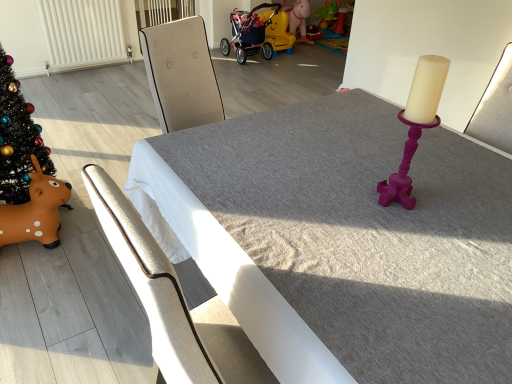
Question: Is the position of smooth gray table at center less distant than that of shiny black christmas tree at left?

Choices:
 (A) no
 (B) yes

Answer: (B)

Question: Does smooth gray table at center have a greater height compared to shiny black christmas tree at left?

Choices:
 (A) yes
 (B) no

Answer: (B)

Question: Does smooth gray table at center have a lesser height compared to shiny black christmas tree at left?

Choices:
 (A) no
 (B) yes

Answer: (B)

Question: Is smooth gray table at center thinner than shiny black christmas tree at left?

Choices:
 (A) no
 (B) yes

Answer: (A)

Question: Considering the relative positions of smooth gray table at center and shiny black christmas tree at left in the image provided, is smooth gray table at center to the right of shiny black christmas tree at left from the viewer's perspective?

Choices:
 (A) yes
 (B) no

Answer: (A)

Question: Considering the positions of smooth gray table at center and white textured radiator at upper left in the image, is smooth gray table at center taller or shorter than white textured radiator at upper left?

Choices:
 (A) short
 (B) tall

Answer: (B)

Question: Relative to white textured radiator at upper left, is smooth gray table at center in front or behind?

Choices:
 (A) behind
 (B) front

Answer: (B)

Question: From a real-world perspective, is smooth gray table at center physically located above or below white textured radiator at upper left?

Choices:
 (A) above
 (B) below

Answer: (A)

Question: Based on their sizes in the image, would you say smooth gray table at center is bigger or smaller than white textured radiator at upper left?

Choices:
 (A) big
 (B) small

Answer: (A)

Question: Considering the positions of rubber yellow horse at center, the 2th toy when ordered from bottom to top, and shiny black christmas tree at left in the image, is rubber yellow horse at center, the 2th toy when ordered from bottom to top, taller or shorter than shiny black christmas tree at left?

Choices:
 (A) tall
 (B) short

Answer: (B)

Question: Considering the positions of rubber yellow horse at center, which ranks as the 1th toy in top-to-bottom order, and shiny black christmas tree at left in the image, is rubber yellow horse at center, which ranks as the 1th toy in top-to-bottom order, wider or thinner than shiny black christmas tree at left?

Choices:
 (A) thin
 (B) wide

Answer: (B)

Question: From a real-world perspective, is rubber yellow horse at center, marked as the 1th toy in a right-to-left arrangement, above or below shiny black christmas tree at left?

Choices:
 (A) below
 (B) above

Answer: (A)

Question: Is rubber yellow horse at center, the 2th toy when ordered from bottom to top, inside the boundaries of shiny black christmas tree at left, or outside?

Choices:
 (A) outside
 (B) inside

Answer: (A)

Question: From the image's perspective, is pink fabric baby carriage at upper center located above or below smooth gray table at center?

Choices:
 (A) below
 (B) above

Answer: (B)

Question: From a real-world perspective, is pink fabric baby carriage at upper center physically located above or below smooth gray table at center?

Choices:
 (A) above
 (B) below

Answer: (B)